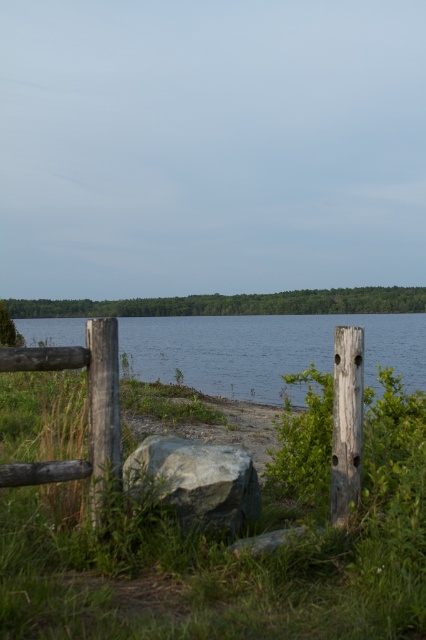
Can you confirm if clear water at center is positioned to the left of gray rough rock at center?

Correct, you'll find clear water at center to the left of gray rough rock at center.

Who is positioned more to the right, clear water at center or gray rough rock at center?

Positioned to the right is gray rough rock at center.

Does point (146, 378) lie in front of point (192, 506)?

No, it is behind (192, 506).

The image size is (426, 640). I want to click on clear water at center, so click(x=265, y=349).

Between clear water at center and weathered wood fence at center, which one is positioned lower?

weathered wood fence at center is lower down.

Does point (290, 358) come farther from viewer compared to point (104, 376)?

That is True.

Which is in front, point (57, 320) or point (104, 397)?

Point (104, 397) is more forward.

The width and height of the screenshot is (426, 640). I want to click on clear water at center, so click(x=265, y=349).

Is point (40, 352) behind point (149, 481)?

That is False.

Who is taller, weathered wood fence at center or gray rough rock at center?

With more height is weathered wood fence at center.

What do you see at coordinates (88, 412) in the screenshot? I see `weathered wood fence at center` at bounding box center [88, 412].

I want to click on weathered wood fence at center, so click(88, 412).